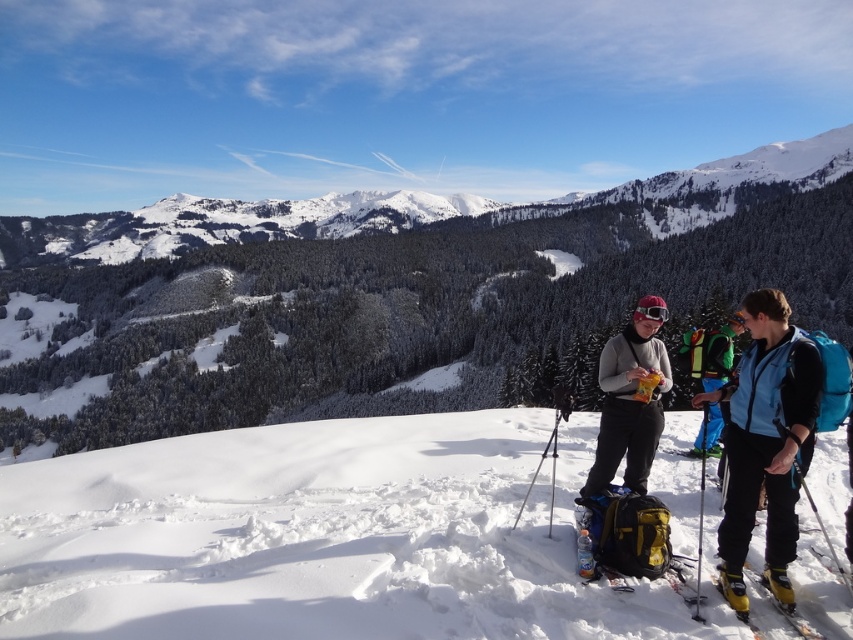
Between point (845, 499) and point (788, 550), which one is positioned behind?

The point (845, 499) is behind.

Is point (840, 596) positioned after point (750, 401)?

No, (840, 596) is in front of (750, 401).

I want to click on white snow at center, so click(x=323, y=536).

Does yellow fabric backpack at center have a greater width compared to green fabric backpack at center?

In fact, yellow fabric backpack at center might be narrower than green fabric backpack at center.

Can you confirm if yellow fabric backpack at center is positioned to the left of green fabric backpack at center?

Yes, yellow fabric backpack at center is to the left of green fabric backpack at center.

The height and width of the screenshot is (640, 853). Describe the element at coordinates (628, 531) in the screenshot. I see `yellow fabric backpack at center` at that location.

Locate an element on the screen. yellow fabric backpack at center is located at coordinates (628, 531).

Does point (627, 381) lie in front of point (631, 556)?

No, (627, 381) is further to viewer.

Who is more distant from viewer, (656, 365) or (664, 566)?

The point (656, 365) is more distant.

Where is `matte gray jacket at center`? matte gray jacket at center is located at coordinates (630, 400).